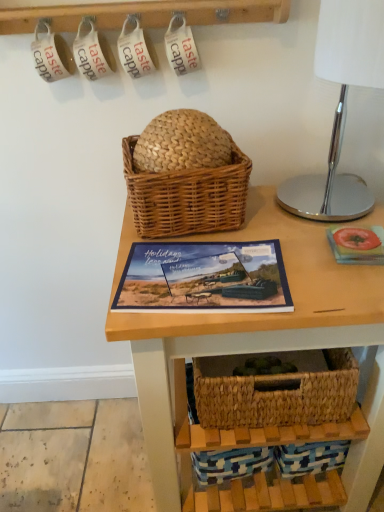
You are a GUI agent. You are given a task and a screenshot of the screen. Output one action in this format:
    pyautogui.click(x=<x>, y=<y>)
    Task: Click on the unoccupied space behind matte blue book at center
    Image resolution: width=384 pixels, height=512 pixels.
    Given the screenshot: What is the action you would take?
    pyautogui.click(x=238, y=228)